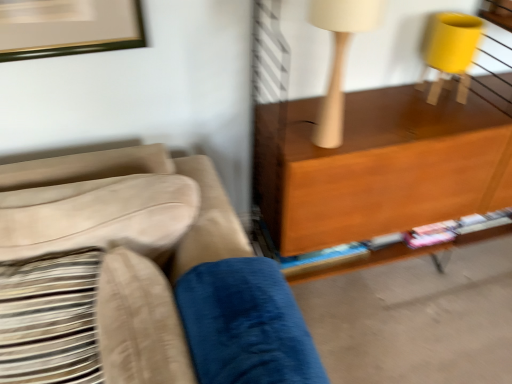
Question: Is white matte table lamp at upper right further to camera compared to velvety blue pillow at lower center, the 2th pillow positioned from the left?

Choices:
 (A) yes
 (B) no

Answer: (A)

Question: Considering the relative positions of white matte table lamp at upper right and velvety blue pillow at lower center, the first pillow positioned from the right, in the image provided, is white matte table lamp at upper right to the right of velvety blue pillow at lower center, the first pillow positioned from the right, from the viewer's perspective?

Choices:
 (A) no
 (B) yes

Answer: (B)

Question: Is white matte table lamp at upper right wider than velvety blue pillow at lower center, the 2th pillow positioned from the left?

Choices:
 (A) yes
 (B) no

Answer: (B)

Question: Is white matte table lamp at upper right surrounding velvety blue pillow at lower center, the 2th pillow positioned from the left?

Choices:
 (A) no
 (B) yes

Answer: (A)

Question: From the image's perspective, is white matte table lamp at upper right over velvety blue pillow at lower center, the 2th pillow positioned from the left?

Choices:
 (A) yes
 (B) no

Answer: (A)

Question: Would you say white matte table lamp at upper right is inside or outside beige textured pillow at left, placed as the 2th pillow when sorted from right to left?

Choices:
 (A) outside
 (B) inside

Answer: (A)

Question: Is white matte table lamp at upper right bigger or smaller than beige textured pillow at left, placed as the 2th pillow when sorted from right to left?

Choices:
 (A) big
 (B) small

Answer: (B)

Question: In terms of height, does white matte table lamp at upper right look taller or shorter compared to beige textured pillow at left, placed as the 2th pillow when sorted from right to left?

Choices:
 (A) tall
 (B) short

Answer: (A)

Question: In terms of width, does white matte table lamp at upper right look wider or thinner when compared to beige textured pillow at left, acting as the first pillow starting from the left?

Choices:
 (A) thin
 (B) wide

Answer: (A)

Question: Which is correct: suede beige couch at left is inside velvety blue pillow at lower center, the first pillow positioned from the right, or outside of it?

Choices:
 (A) inside
 (B) outside

Answer: (B)

Question: Is suede beige couch at left wider or thinner than velvety blue pillow at lower center, the 2th pillow positioned from the left?

Choices:
 (A) thin
 (B) wide

Answer: (B)

Question: Relative to velvety blue pillow at lower center, the 2th pillow positioned from the left, is suede beige couch at left in front or behind?

Choices:
 (A) front
 (B) behind

Answer: (A)

Question: From a real-world perspective, is suede beige couch at left above or below velvety blue pillow at lower center, the first pillow positioned from the right?

Choices:
 (A) below
 (B) above

Answer: (A)

Question: Is beige textured pillow at left, acting as the first pillow starting from the left, to the left or to the right of suede beige couch at left in the image?

Choices:
 (A) left
 (B) right

Answer: (A)

Question: Is beige textured pillow at left, placed as the 2th pillow when sorted from right to left, taller or shorter than suede beige couch at left?

Choices:
 (A) tall
 (B) short

Answer: (B)